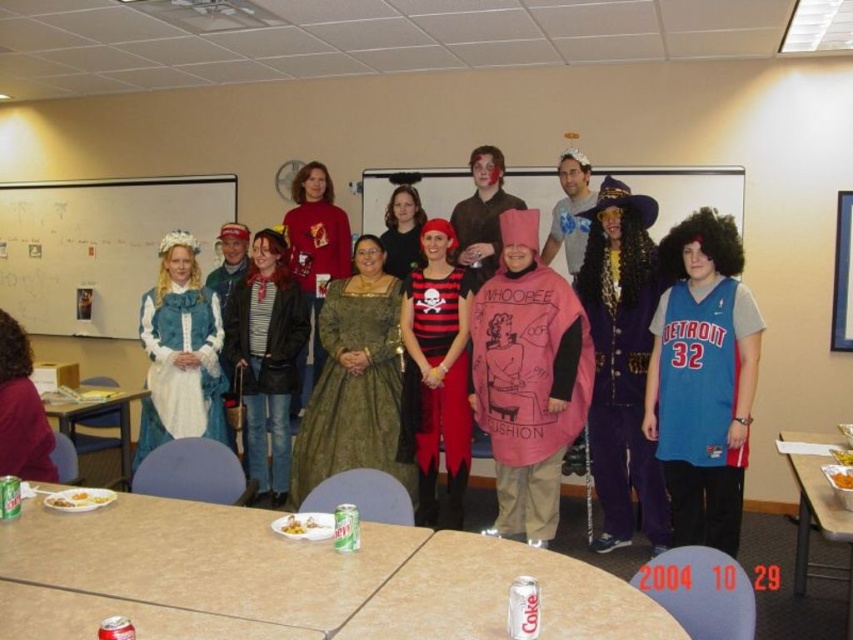
You are a photographer in the room and want to take a clear photo of the white paperboard at center without the pink fabric costume at center blocking it. What should you do?

Move the white paperboard at center forward so it is in front of the pink fabric costume at center, or move the pink fabric costume at center further back so it is behind the white paperboard at center.

You are a photographer standing at the entrance of the room. You need to capture a photo of the smooth beige table at center and the black matte dress at center. How far apart are these two objects from each other?

The smooth beige table at center is 6.52 feet away from the black matte dress at center.

Looking at this image, you are a photographer setting up for a group photo in a classroom. You notice the smooth beige table at center and the black matte dress at center. Which object is located below the other?

The smooth beige table at center is positioned under the black matte dress at center, so the table is below the dress.